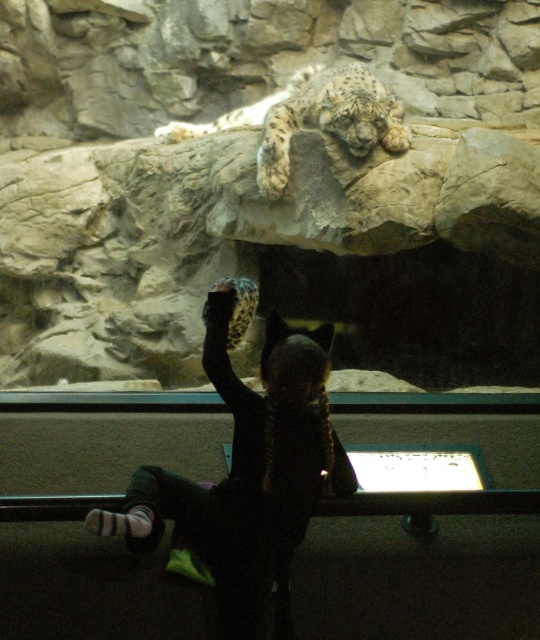
You are a zookeeper responsible for ensuring that all animals are visible to visitors. You notice the dark fur coat at center and the white fur snow leopard at upper center in the enclosure. Which of these two animals is larger in size?

The white fur snow leopard at upper center is larger in size compared to the dark fur coat at center.

You are a zoo visitor trying to take a photo of the snow leopard. You notice two points marked in the image. The first point is at coordinate point (x=143, y=541) and the second is at point (x=366, y=76). Which point is closer to you, the zoo visitor?

Point (x=143, y=541) is closer to the camera than point (x=366, y=76), so the first point is closer to you, the zoo visitor.